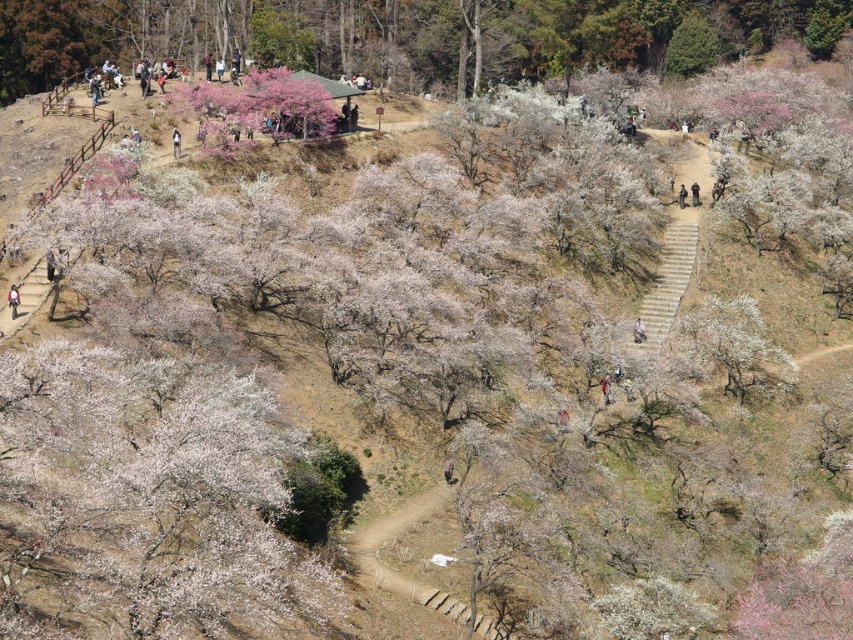
You are a hiker preparing to walk along the winding dirt path in the park. You notice the light brown leather jacket at lower left and the camouflage fabric jacket at center. Which jacket takes up more space in the scene?

The camouflage fabric jacket at center occupies more space than the light brown leather jacket at lower left.

You are standing at the point marked by the coordinates point (13, 300) in the image, which is the location of the light brown leather jacket at lower left. You want to walk to the nearest tree with white blossoms. Which direction should you head towards?

The light brown leather jacket at lower left is located at point (13, 300). To reach the nearest tree with white blossoms, you should head towards the trees in the center area of the image, as they are described as being in full bloom with delicate white blossoms.